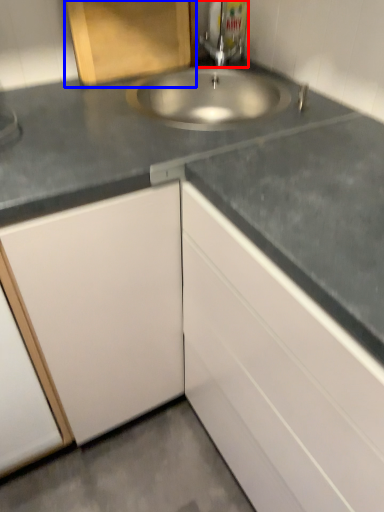
Question: Which object appears closest to the camera in this image, tap (highlighted by a red box) or cabinetry (highlighted by a blue box)?

Choices:
 (A) tap
 (B) cabinetry

Answer: (B)